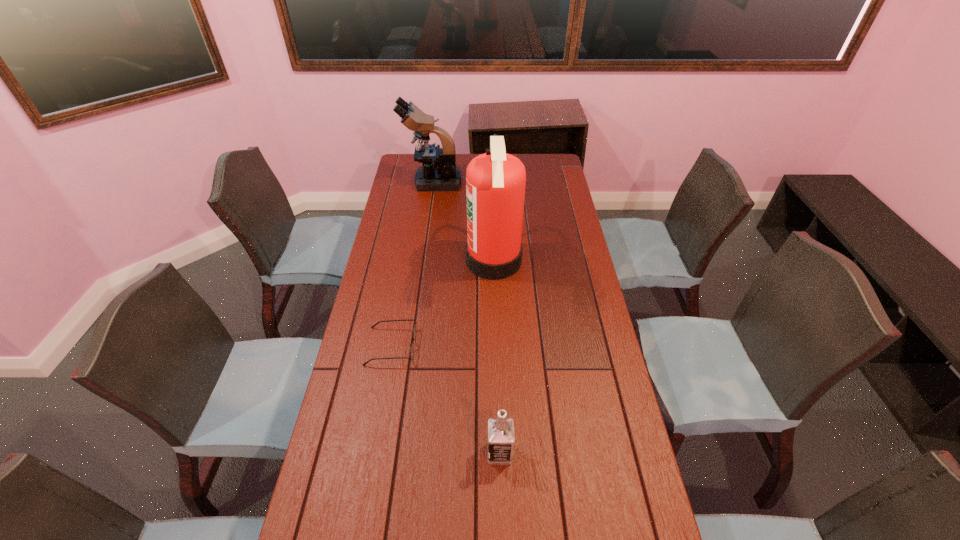
Locate an element on the screen. vacant space positioned 0.330m at the nozzle of the second farthest object is located at coordinates (380, 261).

At what (x,y) coordinates should I click in order to perform the action: click on free space located 0.160m on the front of the farthest object. Please return your answer as a coordinate pair (x, y). The width and height of the screenshot is (960, 540). Looking at the image, I should click on click(x=428, y=213).

At what (x,y) coordinates should I click in order to perform the action: click on free space located on the front label of the nearest object. Please return your answer as a coordinate pair (x, y). Looking at the image, I should click on (407, 453).

Locate an element on the screen. vacant point located 0.330m on the front label of the nearest object is located at coordinates (361, 453).

What are the coordinates of `vacant space situated on the front label of the nearest object` in the screenshot? It's located at (376, 453).

This screenshot has width=960, height=540. What are the coordinates of `free spot located on the front-facing side of the third farthest object` in the screenshot? It's located at (516, 346).

The image size is (960, 540). I want to click on object that is at the far edge, so click(435, 174).

The height and width of the screenshot is (540, 960). What are the coordinates of `microscope situated at the left edge` in the screenshot? It's located at (435, 174).

Where is `spectacles located at the left edge`? The height and width of the screenshot is (540, 960). spectacles located at the left edge is located at coordinates (414, 326).

Where is `object positioned at the far left corner`? The image size is (960, 540). object positioned at the far left corner is located at coordinates (435, 174).